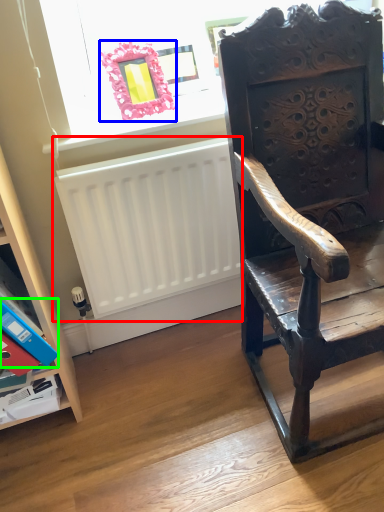
Question: Which is nearer to the radiator (highlighted by a red box)? picture frame (highlighted by a blue box) or paperback book (highlighted by a green box).

Choices:
 (A) picture frame
 (B) paperback book

Answer: (A)